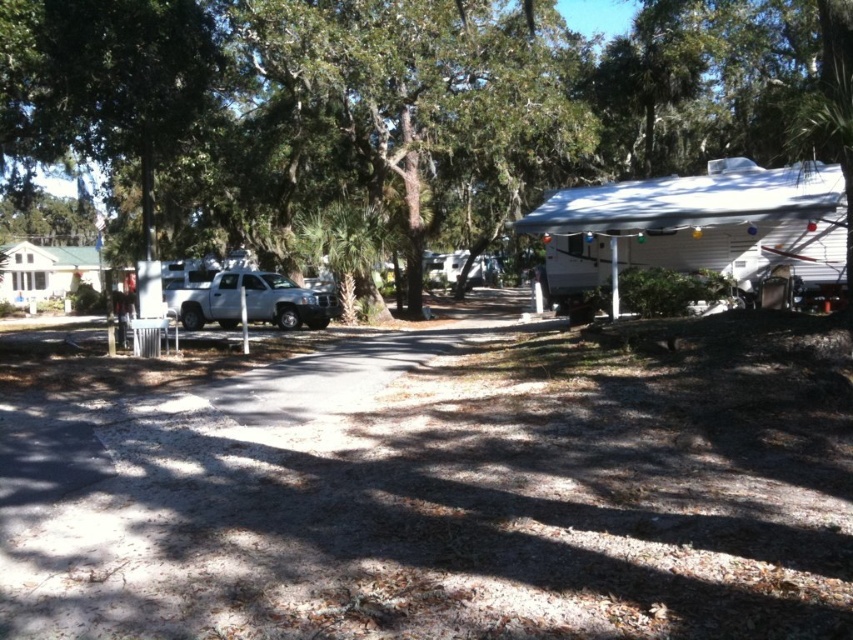
You are standing at the entrance of the campground and want to walk to the white matte camper at right. As you walk towards it, will the green leafy tree at center come into view or disappear from your sight?

The green leafy tree at center is closer to the viewer than the white matte camper at right, so as you walk towards the camper, the tree will gradually disappear from your sight because it is behind you relative to the camper.

You are standing at the camera position and want to walk to both points in the image. Which point should you reach first, point (583, 220) or point (318, 301)?

Point (583, 220) is closer to the camera than point (318, 301), so you will reach point (583, 220) first.